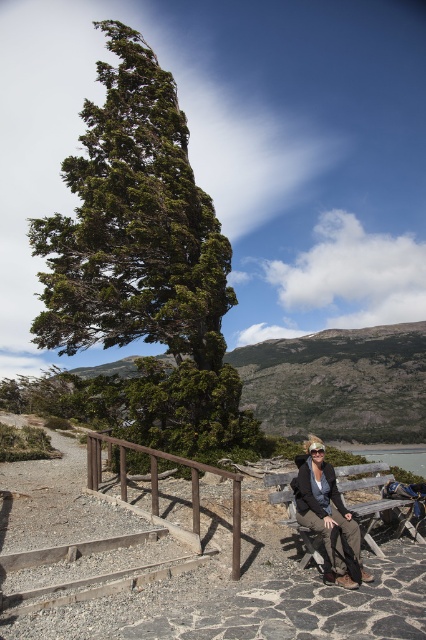
Question: Which point is farther to the camera?

Choices:
 (A) clear blue water at lower right
 (B) green textured tree at center
 (C) brown wood rail at lower center
 (D) khaki pants at center

Answer: (A)

Question: Is brown wood rail at lower center to the right of clear blue water at lower right from the viewer's perspective?

Choices:
 (A) yes
 (B) no

Answer: (B)

Question: Among these objects, which one is farthest from the camera?

Choices:
 (A) wooden bench at center
 (B) clear blue water at lower right

Answer: (B)

Question: Can you confirm if green textured tree at center is thinner than brown wood rail at lower center?

Choices:
 (A) yes
 (B) no

Answer: (B)

Question: Among these objects, which one is nearest to the camera?

Choices:
 (A) brown wood rail at lower center
 (B) green textured tree at center
 (C) clear blue water at lower right

Answer: (A)

Question: Does khaki pants at center appear on the right side of brown wood rail at lower center?

Choices:
 (A) no
 (B) yes

Answer: (B)